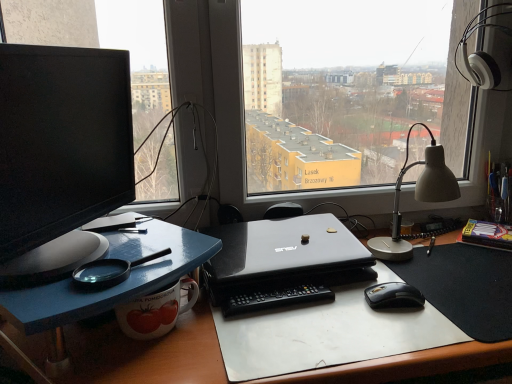
Describe the element at coordinates (60, 156) in the screenshot. This screenshot has width=512, height=384. I see `matte black monitor at left` at that location.

Identify the location of black matte laptop at center. (283, 250).

What is the approximate width of black plastic remote control at center?

2.40 inches.

This screenshot has width=512, height=384. What do you see at coordinates (295, 87) in the screenshot?
I see `transparent glass window at center` at bounding box center [295, 87].

The width and height of the screenshot is (512, 384). What do you see at coordinates (465, 287) in the screenshot?
I see `black rubber mousepad at lower right` at bounding box center [465, 287].

This screenshot has height=384, width=512. In order to click on black rubber mousepad at lower right in this screenshot , I will do `click(465, 287)`.

Identify the location of white plastic notepad at right. The image size is (512, 384). (487, 234).

Describe the element at coordinates (393, 296) in the screenshot. Image resolution: width=512 pixels, height=384 pixels. I see `black glossy mouse at lower right` at that location.

Find the location of a particular element. matte black monitor at left is located at coordinates (60, 156).

Can you tell me how much black rubber mousepad at lower right and white glossy desk at center differ in facing direction?

1.52 degrees.

From a real-world perspective, is black rubber mousepad at lower right physically located above or below white glossy desk at center?

black rubber mousepad at lower right is situated higher than white glossy desk at center in the real world.

Looking at their sizes, would you say black rubber mousepad at lower right is wider or thinner than white glossy desk at center?

In the image, black rubber mousepad at lower right appears to be more narrow than white glossy desk at center.

From the image's perspective, which is below, black rubber mousepad at lower right or white glossy desk at center?

white glossy desk at center appears lower in the image.

Find the location of a particular element. laptop that appears in front of the transparent glass window at center is located at coordinates [x=283, y=250].

What's the angular difference between black matte laptop at center and transparent glass window at center's facing directions?

7.65 degrees separate the facing orientations of black matte laptop at center and transparent glass window at center.

Does black matte laptop at center turn towards transparent glass window at center?

No, black matte laptop at center is not facing towards transparent glass window at center.

Between black plastic remote control at center and matte black monitor at left, which one appears on the right side from the viewer's perspective?

Positioned to the right is black plastic remote control at center.

From a real-world perspective, is black plastic remote control at center positioned over matte black monitor at left based on gravity?

No, from a real-world perspective, black plastic remote control at center is not over matte black monitor at left

Considering the relative sizes of black plastic remote control at center and matte black monitor at left in the image provided, is black plastic remote control at center shorter than matte black monitor at left?

Yes.

Can you tell me how much black plastic remote control at center and matte black monitor at left differ in facing direction?

There is a 52.2-degree angle between the facing directions of black plastic remote control at center and matte black monitor at left.

Is black matte laptop at center turned away from matte black monitor at left?

No.

Locate an element on the screen. computer monitor located above the black matte laptop at center (from a real-world perspective) is located at coordinates (60, 156).

Looking at the image, does black matte laptop at center seem bigger or smaller compared to matte black monitor at left?

In the image, black matte laptop at center appears to be smaller than matte black monitor at left.

Does black matte laptop at center have a greater width compared to matte black monitor at left?

Yes.

Who is more distant, white glossy desk at center or black plastic remote control at center?

black plastic remote control at center is further from the camera.

Is white glossy desk at center directly adjacent to black plastic remote control at center?

white glossy desk at center is not next to black plastic remote control at center, and they're not touching.

What's the angular difference between white glossy desk at center and black plastic remote control at center's facing directions?

The facing directions of white glossy desk at center and black plastic remote control at center are 4.99 degrees apart.

Who is shorter, white glossy desk at center or black plastic remote control at center?

Standing shorter between the two is black plastic remote control at center.

Who is taller, black rubber mousepad at lower right or black plastic remote control at center?

With more height is black plastic remote control at center.

Considering the relative positions of black rubber mousepad at lower right and black plastic remote control at center in the image provided, is black rubber mousepad at lower right to the right of black plastic remote control at center from the viewer's perspective?

Yes, black rubber mousepad at lower right is to the right of black plastic remote control at center.

From a real-world perspective, which is physically above, black rubber mousepad at lower right or black plastic remote control at center?

black plastic remote control at center.

Is black plastic remote control at center a part of black rubber mousepad at lower right?

Definitely not — black plastic remote control at center is not inside black rubber mousepad at lower right.

Is black matte laptop at center positioned far away from white plastic table lamp at right?

black matte laptop at center is near white plastic table lamp at right, not far away.

Is black matte laptop at center in front of white plastic table lamp at right?

That is True.

From a real-world perspective, is black matte laptop at center located beneath white plastic table lamp at right?

Yes, from a real-world perspective, black matte laptop at center is below white plastic table lamp at right.

Based on their positions, is black matte laptop at center located to the left or right of white plastic table lamp at right?

In the image, black matte laptop at center appears on the left side of white plastic table lamp at right.

Find the location of `mousepad that is on the right side of white glossy desk at center`. mousepad that is on the right side of white glossy desk at center is located at coordinates (465, 287).

The height and width of the screenshot is (384, 512). Find the location of `laptop located below the transparent glass window at center (from the image's perspective)`. laptop located below the transparent glass window at center (from the image's perspective) is located at coordinates (283, 250).

Estimate the real-world distances between objects in this image. Which object is further from transparent glass window at center, black glossy mouse at lower right or white plastic notepad at right?

Based on the image, black glossy mouse at lower right appears to be further to transparent glass window at center.

Looking at the image, which one is located closer to transparent glass window at center, black matte laptop at center or black plastic remote control at center?

black matte laptop at center.

When comparing their distances from white glossy desk at center, does white plastic table lamp at right or black matte laptop at center seem closer?

The object closer to white glossy desk at center is black matte laptop at center.

Considering their positions, is black plastic remote control at center positioned closer to black rubber mousepad at lower right than black glossy mouse at lower right?

black glossy mouse at lower right.

When comparing their distances from black rubber mousepad at lower right, does black plastic remote control at center or black matte laptop at center seem further?

black plastic remote control at center is positioned further to the anchor black rubber mousepad at lower right.

When comparing their distances from white glossy desk at center, does black plastic remote control at center or black matte laptop at center seem further?

Based on the image, black matte laptop at center appears to be further to white glossy desk at center.

Estimate the real-world distances between objects in this image. Which object is further from transparent glass window at center, matte black monitor at left or white plastic notepad at right?

white plastic notepad at right.

Considering their positions, is black matte laptop at center positioned further to matte black monitor at left than transparent glass window at center?

Result: Based on the image, transparent glass window at center appears to be further to matte black monitor at left.

The width and height of the screenshot is (512, 384). In order to click on laptop keyboard between matte black monitor at left and white plastic table lamp at right in this screenshot , I will do (x=275, y=298).

Locate an element on the screen. The image size is (512, 384). window between black matte laptop at center and black rubber mousepad at lower right from left to right is located at coordinates (295, 87).

At what (x,y) coordinates should I click in order to perform the action: click on laptop between white glossy desk at center and black glossy mouse at lower right along the z-axis. Please return your answer as a coordinate pair (x, y). Looking at the image, I should click on (283, 250).

Where is `desk situated between transparent glass window at center and white plastic notepad at right from left to right`? Image resolution: width=512 pixels, height=384 pixels. desk situated between transparent glass window at center and white plastic notepad at right from left to right is located at coordinates (126, 353).